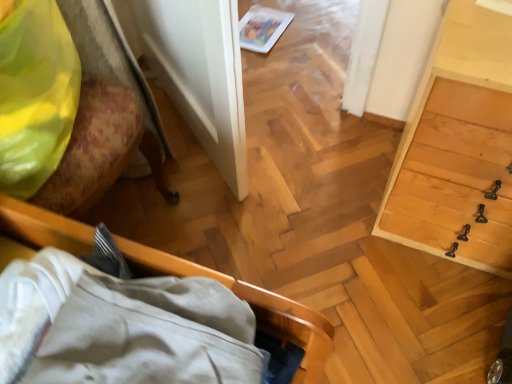
Question: Is wooden bed frame at lower left, the second furniture in the left-to-right sequence, positioned with its back to light wood dresser at right?

Choices:
 (A) yes
 (B) no

Answer: (B)

Question: From a real-world perspective, is wooden bed frame at lower left, which ranks as the first furniture in right-to-left order, positioned under light wood dresser at right based on gravity?

Choices:
 (A) yes
 (B) no

Answer: (B)

Question: Can you confirm if wooden bed frame at lower left, the second furniture in the left-to-right sequence, is positioned to the left of light wood dresser at right?

Choices:
 (A) no
 (B) yes

Answer: (B)

Question: From the image's perspective, is wooden bed frame at lower left, which ranks as the first furniture in right-to-left order, over light wood dresser at right?

Choices:
 (A) yes
 (B) no

Answer: (B)

Question: Is light wood dresser at right surrounded by wooden bed frame at lower left, the second furniture in the left-to-right sequence?

Choices:
 (A) yes
 (B) no

Answer: (B)

Question: Is wooden bed frame at lower left, which ranks as the first furniture in right-to-left order, located outside light wood dresser at right?

Choices:
 (A) yes
 (B) no

Answer: (A)

Question: Is light wood dresser at right turned away from white glossy magazine at upper center?

Choices:
 (A) no
 (B) yes

Answer: (A)

Question: Is light wood dresser at right shorter than white glossy magazine at upper center?

Choices:
 (A) no
 (B) yes

Answer: (A)

Question: Can we say light wood dresser at right lies outside white glossy magazine at upper center?

Choices:
 (A) no
 (B) yes

Answer: (B)

Question: From a real-world perspective, is light wood dresser at right below white glossy magazine at upper center?

Choices:
 (A) no
 (B) yes

Answer: (A)

Question: Would you consider light wood dresser at right to be distant from white glossy magazine at upper center?

Choices:
 (A) yes
 (B) no

Answer: (A)

Question: From a real-world perspective, is light wood dresser at right on top of white glossy magazine at upper center?

Choices:
 (A) yes
 (B) no

Answer: (A)

Question: Does white glossy magazine at upper center contain wooden bed frame at lower left, which ranks as the first furniture in right-to-left order?

Choices:
 (A) no
 (B) yes

Answer: (A)